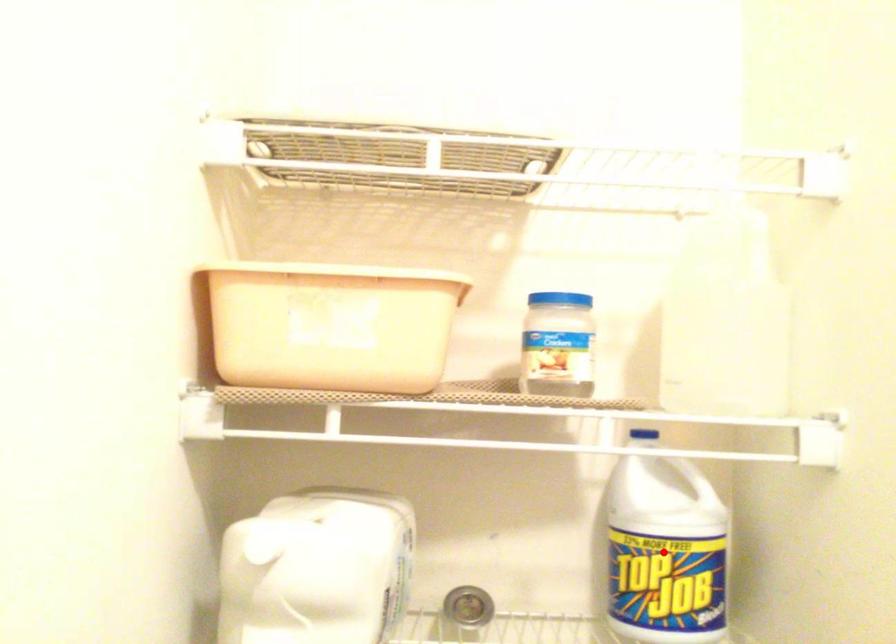
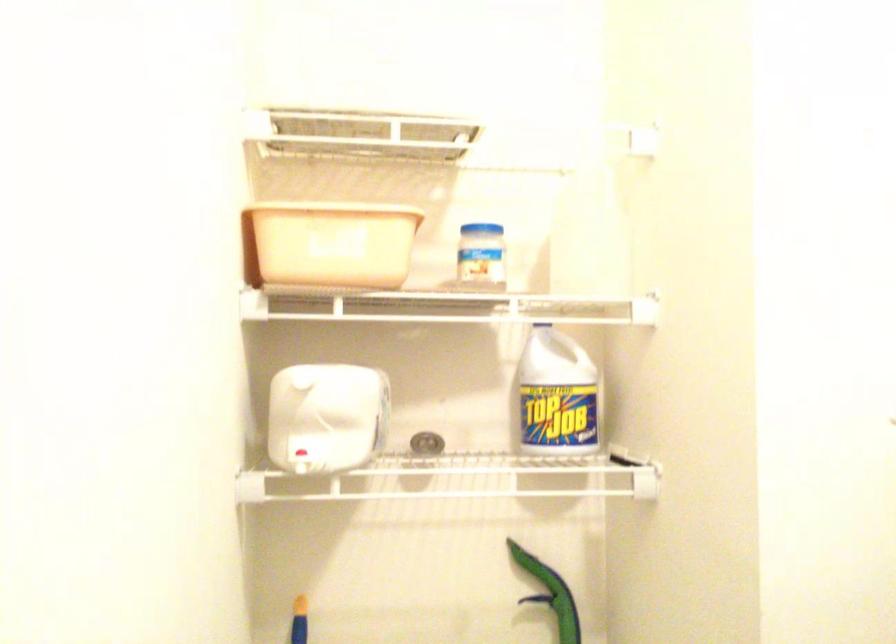
Question: I am providing you with two images of the same scene from different viewpoints. Given a red point in image1, look at the same physical point in image2. Is it:

Choices:
 (A) Closer to the viewpoint
 (B) Farther from the viewpoint

Answer: (B)